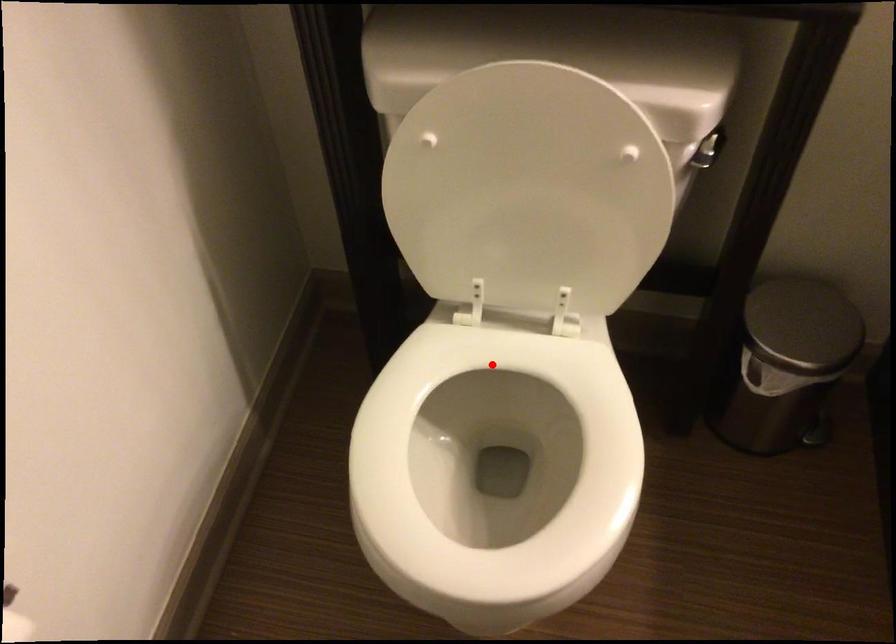
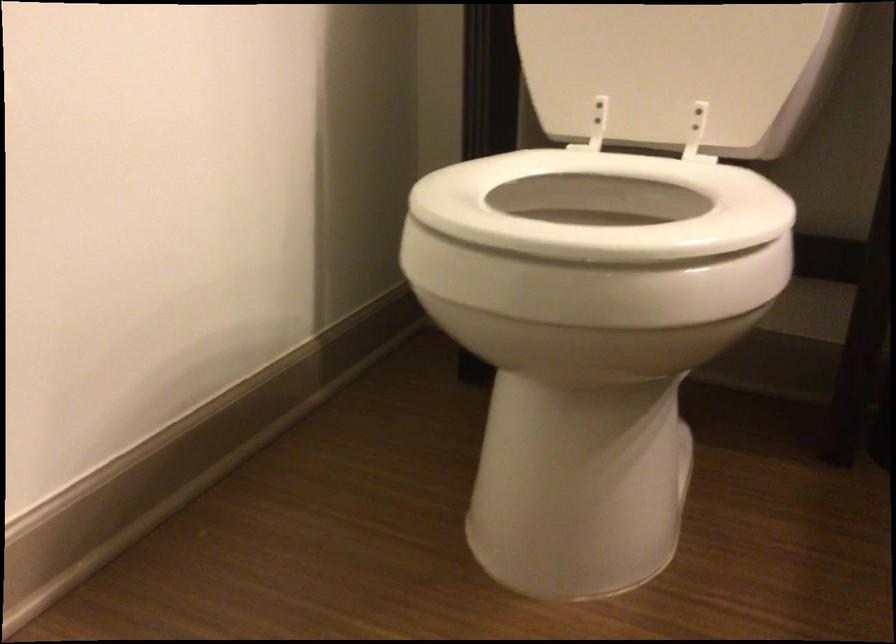
Question: A red point is marked in image1. In image2, is the corresponding 3D point closer to the camera or farther? Reply with the corresponding letter.

Choices:
 (A) The corresponding 3D point is closer.
 (B) The corresponding 3D point is farther.

Answer: (A)